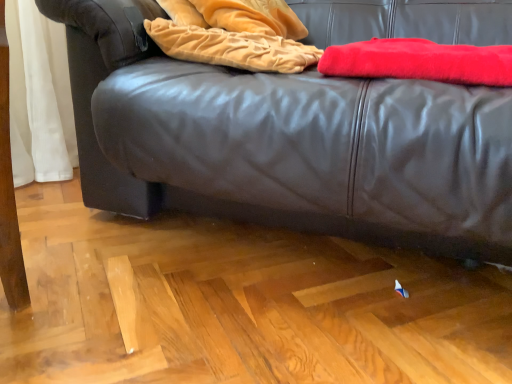
Question: Looking at their shapes, would you say black leather couch at center is wider or thinner than velvet gold blanket at upper center, which is the second blanket in right-to-left order?

Choices:
 (A) thin
 (B) wide

Answer: (B)

Question: Considering their positions, is black leather couch at center located in front of or behind velvet gold blanket at upper center, which is the second blanket in right-to-left order?

Choices:
 (A) behind
 (B) front

Answer: (B)

Question: Estimate the real-world distances between objects in this image. Which object is farther from the velvet gold blanket at upper center, which appears as the 1th blanket when viewed from the left?

Choices:
 (A) black leather couch at center
 (B) red fuzzy blanket at upper right, the 2th blanket when ordered from left to right

Answer: (B)

Question: Based on their relative distances, which object is nearer to the red fuzzy blanket at upper right, the 1th blanket from the right?

Choices:
 (A) black leather couch at center
 (B) velvet gold blanket at upper center, which appears as the 1th blanket when viewed from the left

Answer: (B)